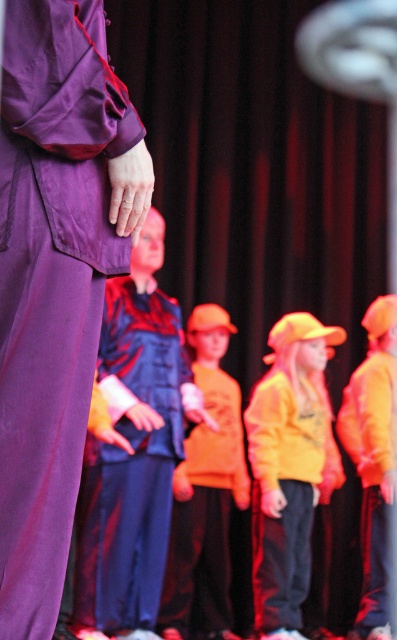
You are an event organizer arranging seating for a small audience. You need to decide where to place two performers based on their robe sizes. The purple matte robe at left and the velvet blue robe at center are the performers. Which performer should be seated closer to the front to ensure visibility given their robe sizes?

The purple matte robe at left has a smaller size compared to the velvet blue robe at center. Therefore, the performer in the velvet blue robe at center should be seated closer to the front to ensure their larger size is visible to the audience.

You are an event planner arranging seating for a small gathering. You need to decide where to place two attendees based on their clothing. The velvet blue robe at center and the orange fleece jacket at right are present. Which attendee should sit in a wider chair to accommodate their robe?

The velvet blue robe at center requires a wider chair since its width is larger than the orange fleece jacket at right.

You are an actor standing on stage and you see two points marked on the stage floor. The first point is labeled as point (156, 397) and the second is point (341, 442). Which point is closer to you if you are facing the audience?

Point (156, 397) is in front of point (341, 442), so it is closer to you when facing the audience.